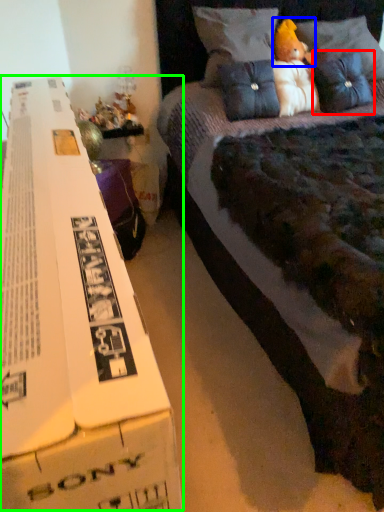
Question: Which object is positioned farthest from pillow (highlighted by a red box)? Select from toy (highlighted by a blue box) and paperback book (highlighted by a green box).

Choices:
 (A) toy
 (B) paperback book

Answer: (B)